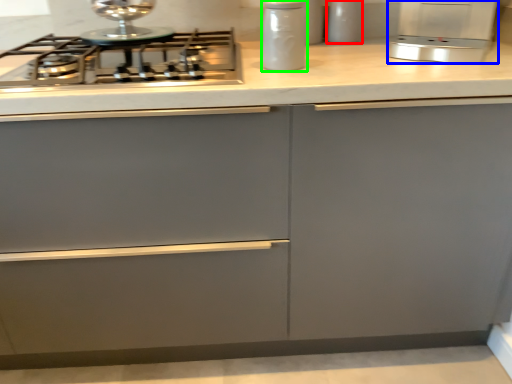
Question: Considering the real-world distances, which object is farthest from kitchen appliance (highlighted by a red box)? kitchen appliance (highlighted by a blue box) or kitchen appliance (highlighted by a green box)?

Choices:
 (A) kitchen appliance
 (B) kitchen appliance

Answer: (B)